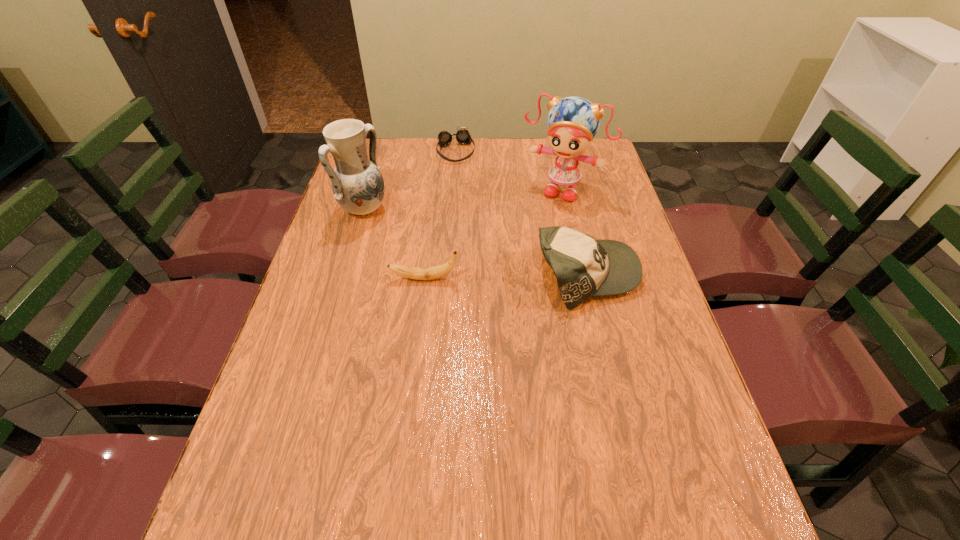
Where is `baseball cap that is positioned at the right edge`? This screenshot has height=540, width=960. baseball cap that is positioned at the right edge is located at coordinates (584, 267).

Locate an element on the screen. doll at the right edge is located at coordinates (572, 122).

I want to click on object present at the far right corner, so click(x=572, y=122).

Locate an element on the screen. The width and height of the screenshot is (960, 540). free space at the far edge of the desktop is located at coordinates (513, 170).

Locate an element on the screen. The height and width of the screenshot is (540, 960). vacant area at the near edge of the desktop is located at coordinates (477, 492).

Locate an element on the screen. blank space at the left edge of the desktop is located at coordinates (319, 280).

Find the location of `free space at the right edge of the desktop`. free space at the right edge of the desktop is located at coordinates (661, 386).

This screenshot has height=540, width=960. In order to click on vacant space at the near left corner in this screenshot , I will do `click(317, 446)`.

The width and height of the screenshot is (960, 540). Identify the location of free space between the shortest object and the baseball cap. (521, 213).

What are the coordinates of `free space between the baseball cap and the pottery` in the screenshot? It's located at (475, 243).